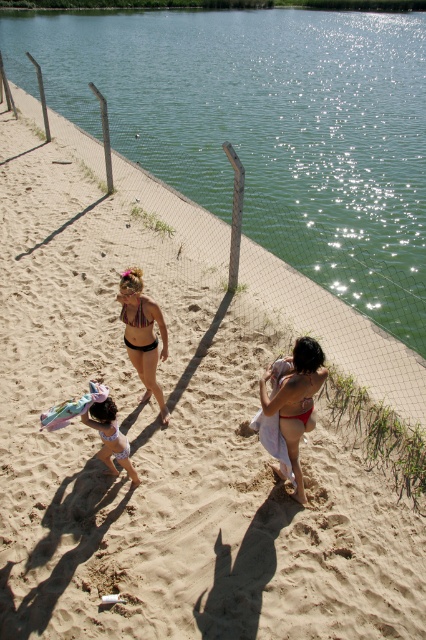
Who is positioned more to the left, red matte bikini at lower right or multicolored woven bikini top at center?

multicolored woven bikini top at center is more to the left.

From the picture: Can you confirm if red matte bikini at lower right is positioned to the right of multicolored woven bikini top at center?

Correct, you'll find red matte bikini at lower right to the right of multicolored woven bikini top at center.

The image size is (426, 640). Find the location of `red matte bikini at lower right`. red matte bikini at lower right is located at coordinates (296, 401).

Where is `red matte bikini at lower right`? red matte bikini at lower right is located at coordinates (296, 401).

Who is shorter, multicolored bikini top at center or white matte bikini at center?

white matte bikini at center is shorter.

Does point (127, 317) lie in front of point (129, 442)?

Yes, point (127, 317) is in front of point (129, 442).

In order to click on multicolored bikini top at center in this screenshot , I will do `click(143, 333)`.

Can you confirm if multicolored woven bikini top at center is wider than matte white bikini at center?

Indeed, multicolored woven bikini top at center has a greater width compared to matte white bikini at center.

Is multicolored woven bikini top at center to the right of matte white bikini at center from the viewer's perspective?

Incorrect, multicolored woven bikini top at center is not on the right side of matte white bikini at center.

Measure the distance between multicolored woven bikini top at center and camera.

4.92 meters

The image size is (426, 640). Identify the location of multicolored woven bikini top at center. (x=135, y=316).